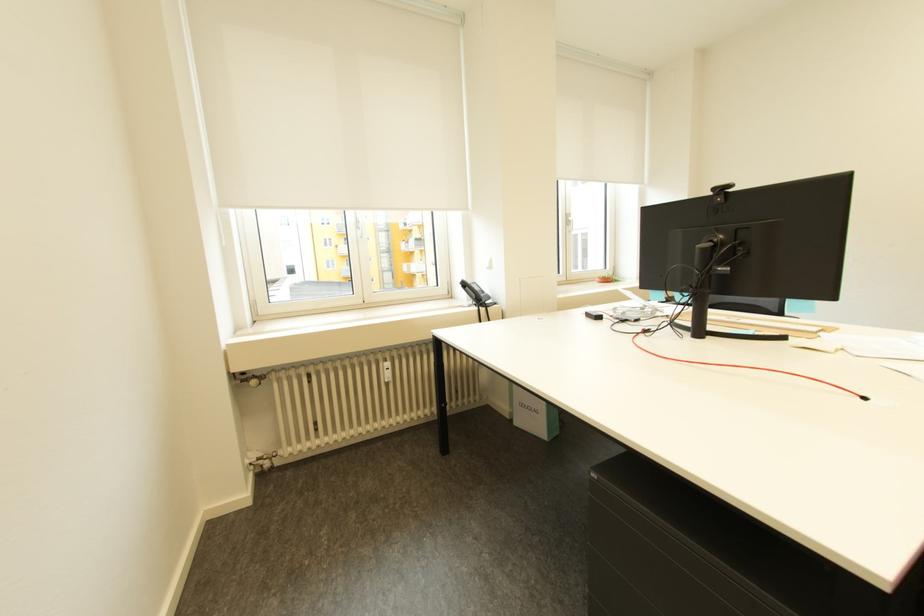
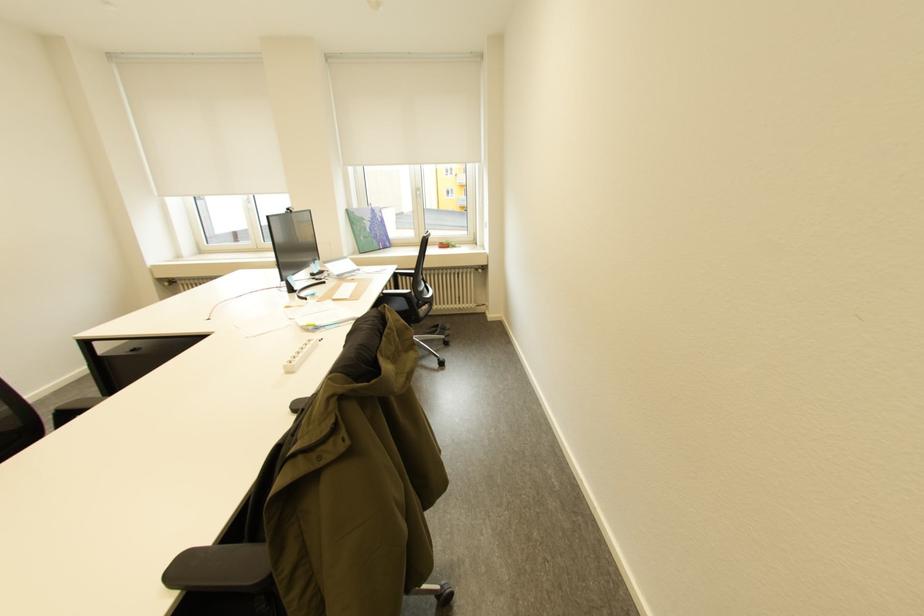
Question: In a continuous first-person perspective shot, in which direction is the camera moving?

Choices:
 (A) Left
 (B) Right
 (C) Forward
 (D) Backward

Answer: (B)